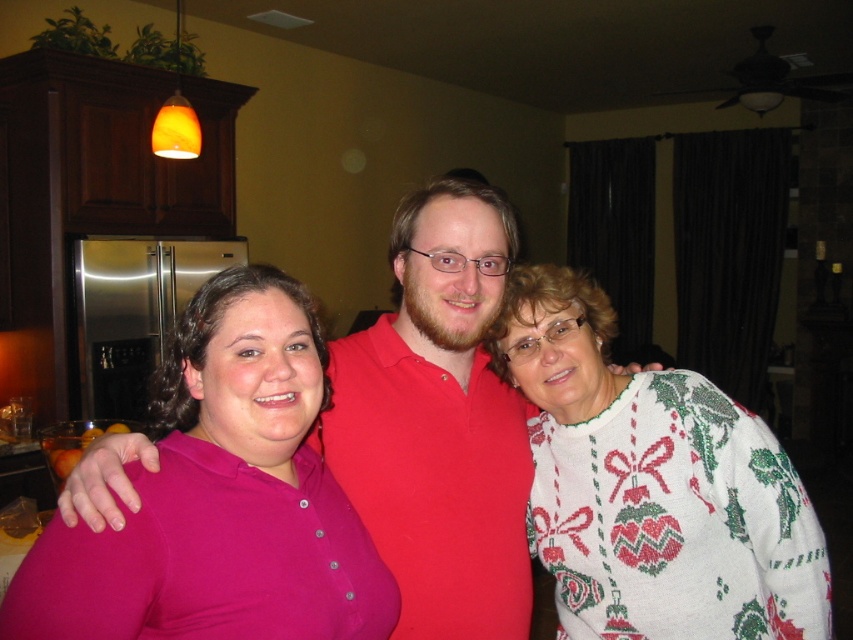
You are organizing a clothing donation drive and need to determine which of the two garments, the matte pink shirt at center or the white knitted sweater at right, takes up more space when folded. Based on their sizes, which one requires more storage space?

The white knitted sweater at right requires more storage space when folded because it has a greater width than the matte pink shirt at center.

You are standing in the kitchen and want to hand a recipe card to both the matte pink shirt at center and the white knitted sweater at right. Which person should you approach first based on their proximity to you?

You should approach the matte pink shirt at center first because it is closer to you than the white knitted sweater at right.

You are a fashion designer observing the three people in the kitchen scene. You need to determine which clothing item, the white knitted sweater at right or the matte red shirt at center, would require less fabric to produce a similar style. Based on their sizes in the image, which one would need less material?

The white knitted sweater at right is shorter than the matte red shirt at center, so it would require less fabric to produce a similar style.